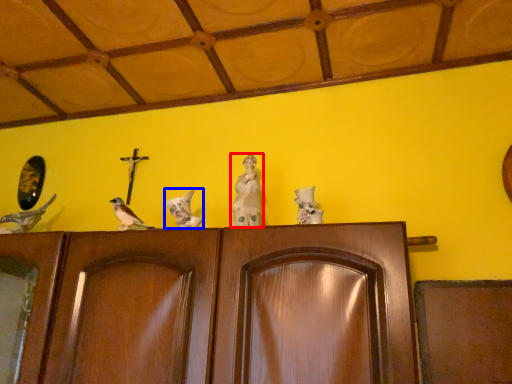
Question: Which of the following is the farthest to the observer, sculpture (highlighted by a red box) or bird (highlighted by a blue box)?

Choices:
 (A) sculpture
 (B) bird

Answer: (B)